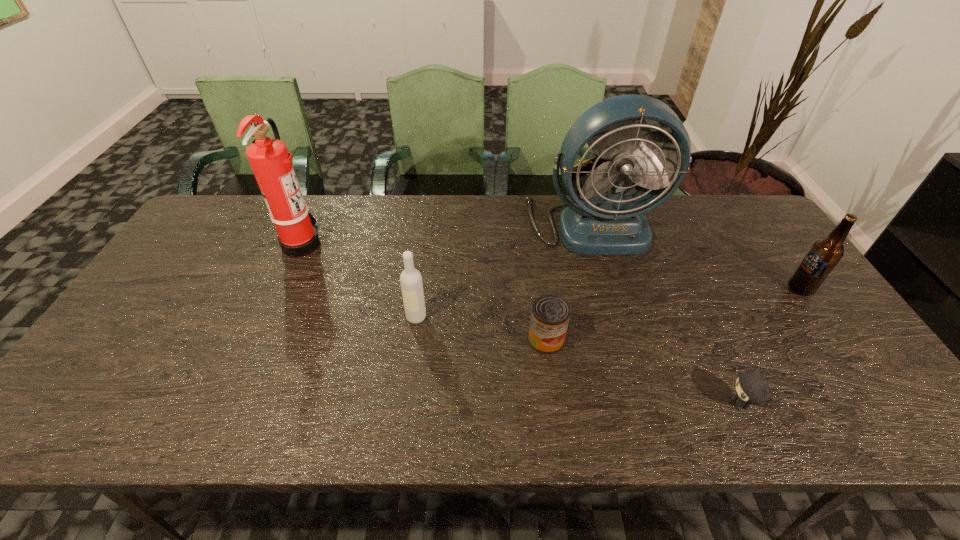
At what (x,y) coordinates should I click in order to perform the action: click on fire extinguisher that is at the far edge. Please return your answer as a coordinate pair (x, y). The image size is (960, 540). Looking at the image, I should click on (270, 160).

You are a GUI agent. You are given a task and a screenshot of the screen. Output one action in this format:
    pyautogui.click(x=<x>, y=<y>)
    Task: Click on the object that is positioned at the near edge
    The image size is (960, 540).
    Given the screenshot: What is the action you would take?
    pyautogui.click(x=751, y=388)

Where is `object at the right edge`? The width and height of the screenshot is (960, 540). object at the right edge is located at coordinates (823, 256).

The height and width of the screenshot is (540, 960). Find the location of `blank space at the far edge`. blank space at the far edge is located at coordinates (683, 206).

The width and height of the screenshot is (960, 540). Identify the location of blank space at the near edge of the desktop. (791, 406).

I want to click on blank space at the right edge, so (809, 376).

In the image, there is a desktop. Identify the location of vacant space at the near right corner. This screenshot has width=960, height=540. (852, 418).

Image resolution: width=960 pixels, height=540 pixels. What are the coordinates of `vacant space in between the fourth nearest object and the fan` in the screenshot? It's located at (696, 256).

The image size is (960, 540). Find the location of `vacant space that's between the fire extinguisher and the fan`. vacant space that's between the fire extinguisher and the fan is located at coordinates (447, 234).

Find the location of a particular element. The width and height of the screenshot is (960, 540). vacant area that lies between the shortest object and the fan is located at coordinates (666, 314).